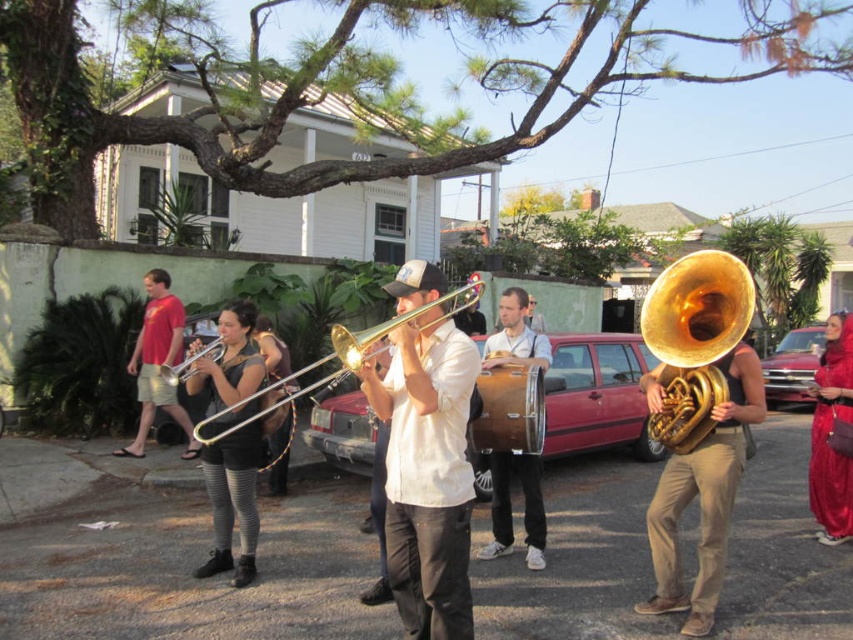
Between metallic red car at center and gold shiny trumpet at center, which one is positioned lower?

metallic red car at center

Can you confirm if metallic red car at center is bigger than gold shiny trumpet at center?

Yes, metallic red car at center is bigger than gold shiny trumpet at center.

Measure the distance between point (553,451) and camera.

A distance of 7.21 meters exists between point (553,451) and camera.

Identify the location of metallic red car at center. (596, 394).

Describe the element at coordinates (427, 474) in the screenshot. I see `shiny gold trombone at center` at that location.

Between shiny gold trombone at center and shiny red dress at right, which one appears on the right side from the viewer's perspective?

Positioned to the right is shiny red dress at right.

What do you see at coordinates (427, 474) in the screenshot?
I see `shiny gold trombone at center` at bounding box center [427, 474].

Identify the location of shiny gold trombone at center. This screenshot has width=853, height=640. (427, 474).

Is point (532, 561) in front of point (276, 465)?

Yes, it is.

Is wooden drum at center shorter than black leather pants at center?

Yes, wooden drum at center is shorter than black leather pants at center.

You are a GUI agent. You are given a task and a screenshot of the screen. Output one action in this format:
    pyautogui.click(x=<x>, y=<y>)
    Task: Click on the wooden drum at center
    The height and width of the screenshot is (640, 853).
    Given the screenshot: What is the action you would take?
    pyautogui.click(x=509, y=508)